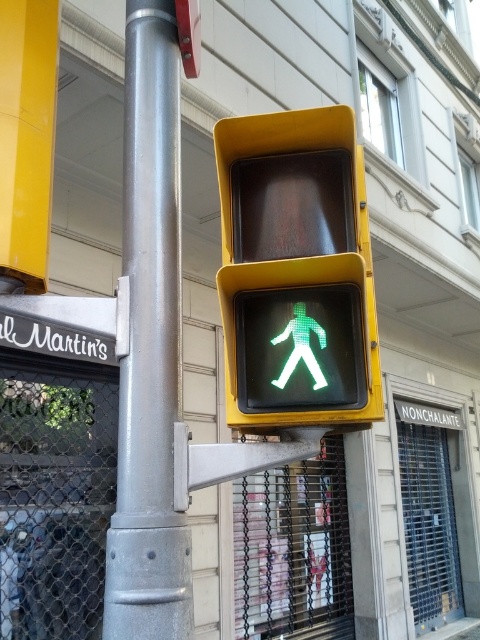
Looking at this image, you are a delivery person with a 10 inch wide box. You need to place the box between the matte yellow pedestrian signal at center and the silver metallic pole at center. Can the box fit in the space between them?

The distance between the matte yellow pedestrian signal at center and the silver metallic pole at center is 9.91 inches, so the 10 inch wide box cannot fit in the space between them.

You are a delivery person holding a box that is 1.2 meters wide. You are standing directly in front of the matte yellow pedestrian signal at center. Can you fit the box horizontally between yourself and the signal without tilting it?

The distance between you and the matte yellow pedestrian signal at center is 1.12 meters, which is shorter than the box width of 1.2 meters. Therefore, the box cannot fit horizontally between you and the signal without tilting it.